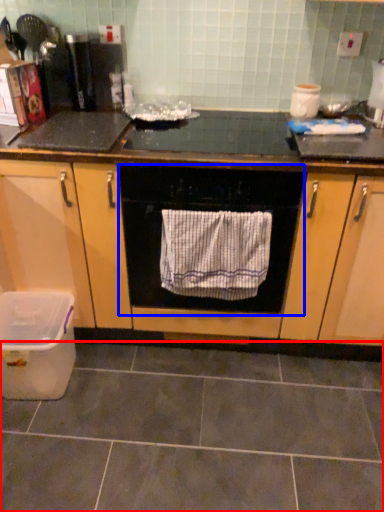
Question: Which point is closer to the camera, ceramic tile (highlighted by a red box) or home appliance (highlighted by a blue box)?

Choices:
 (A) ceramic tile
 (B) home appliance

Answer: (A)